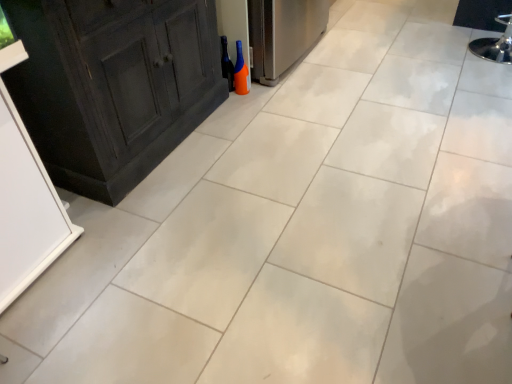
Question: From a real-world perspective, is orange matte bottle at center above or below black glass wine bottle at center?

Choices:
 (A) below
 (B) above

Answer: (A)

Question: Would you say orange matte bottle at center is to the left or to the right of black glass wine bottle at center in the picture?

Choices:
 (A) right
 (B) left

Answer: (A)

Question: In the image, is orange matte bottle at center positioned in front of or behind black glass wine bottle at center?

Choices:
 (A) behind
 (B) front

Answer: (B)

Question: Do you think black glass wine bottle at center is within orange matte bottle at center, or outside of it?

Choices:
 (A) outside
 (B) inside

Answer: (A)

Question: Considering the positions of black glass wine bottle at center and orange matte bottle at center in the image, is black glass wine bottle at center taller or shorter than orange matte bottle at center?

Choices:
 (A) short
 (B) tall

Answer: (B)

Question: Looking at their shapes, would you say black glass wine bottle at center is wider or thinner than orange matte bottle at center?

Choices:
 (A) thin
 (B) wide

Answer: (A)

Question: Relative to orange matte bottle at center, is black glass wine bottle at center in front or behind?

Choices:
 (A) front
 (B) behind

Answer: (B)